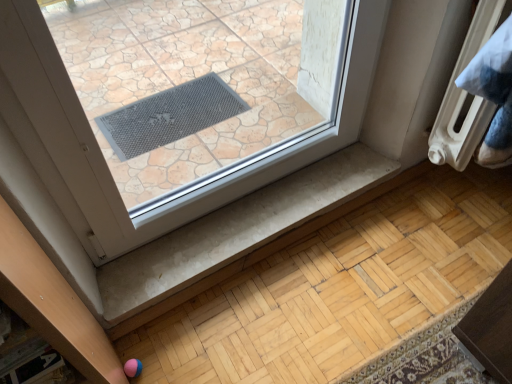
What is the approximate height of white matte stair at lower center?

white matte stair at lower center is 1.56 inches in height.

The width and height of the screenshot is (512, 384). What do you see at coordinates (236, 231) in the screenshot? I see `white matte stair at lower center` at bounding box center [236, 231].

Where is `white matte stair at lower center`? The height and width of the screenshot is (384, 512). white matte stair at lower center is located at coordinates (236, 231).

In order to face white matte stair at lower center, should I rotate leftwards or rightwards?

Turn right by 0.579 degrees to look at white matte stair at lower center.

Where is `white plastic radiator at upper right`? white plastic radiator at upper right is located at coordinates (465, 96).

This screenshot has height=384, width=512. What do you see at coordinates (465, 96) in the screenshot?
I see `white plastic radiator at upper right` at bounding box center [465, 96].

The height and width of the screenshot is (384, 512). In order to click on white matte stair at lower center in this screenshot , I will do `click(236, 231)`.

Would you say white plastic radiator at upper right is to the left or to the right of white matte stair at lower center in the picture?

white plastic radiator at upper right is to the right of white matte stair at lower center.

Considering the positions of objects white plastic radiator at upper right and white matte stair at lower center in the image provided, who is behind, white plastic radiator at upper right or white matte stair at lower center?

white matte stair at lower center is further away from the camera.

Does point (477, 129) lie behind point (121, 305)?

Yes, it is.

From the picture: From the image's perspective, is white plastic radiator at upper right on top of white matte stair at lower center?

Yes, from the image's perspective, white plastic radiator at upper right is above white matte stair at lower center.

From a real-world perspective, is white plastic radiator at upper right physically above white matte stair at lower center?

Yes, from a real-world perspective, white plastic radiator at upper right is on top of white matte stair at lower center.

Is white plastic radiator at upper right wider or thinner than white matte stair at lower center?

Clearly, white plastic radiator at upper right has less width compared to white matte stair at lower center.

Who is taller, white plastic radiator at upper right or white matte stair at lower center?

white plastic radiator at upper right.

Can you confirm if white plastic radiator at upper right is bigger than white matte stair at lower center?

Correct, white plastic radiator at upper right is larger in size than white matte stair at lower center.

Would you say white plastic radiator at upper right is outside white matte stair at lower center?

That's correct, white plastic radiator at upper right is outside of white matte stair at lower center.

Is white plastic radiator at upper right far away from white matte stair at lower center?

No.

Is white plastic radiator at upper right turned away from white matte stair at lower center?

No, white matte stair at lower center is not at the back of white plastic radiator at upper right.

The width and height of the screenshot is (512, 384). I want to click on stair below the white plastic radiator at upper right (from the image's perspective), so click(236, 231).

Is white matte stair at lower center to the right of white plastic radiator at upper right from the viewer's perspective?

Incorrect, white matte stair at lower center is not on the right side of white plastic radiator at upper right.

Does white matte stair at lower center lie behind white plastic radiator at upper right?

Yes, white matte stair at lower center is further from the camera.

Which is less distant, (131, 284) or (488, 112)?

Point (131, 284) appears to be farther away from the viewer than point (488, 112).

Consider the image. From the image's perspective, is white matte stair at lower center positioned above or below white plastic radiator at upper right?

white matte stair at lower center is below white plastic radiator at upper right.

From a real-world perspective, is white matte stair at lower center physically above white plastic radiator at upper right?

Incorrect, from a real-world perspective, white matte stair at lower center is lower than white plastic radiator at upper right.

Considering the sizes of objects white matte stair at lower center and white plastic radiator at upper right in the image provided, who is wider, white matte stair at lower center or white plastic radiator at upper right?

white matte stair at lower center is wider.

Consider the image. Is white matte stair at lower center taller than white plastic radiator at upper right?

Incorrect, the height of white matte stair at lower center is not larger of that of white plastic radiator at upper right.

Is white matte stair at lower center smaller than white plastic radiator at upper right?

Yes, white matte stair at lower center is smaller than white plastic radiator at upper right.

Does white matte stair at lower center contain white plastic radiator at upper right?

No.

Is white matte stair at lower center positioned far away from white plastic radiator at upper right?

No, white matte stair at lower center is in close proximity to white plastic radiator at upper right.

Is white plastic radiator at upper right at the back of white matte stair at lower center?

No.

How many degrees apart are the facing directions of white matte stair at lower center and white plastic radiator at upper right?

The angular difference between white matte stair at lower center and white plastic radiator at upper right is 0.443 degrees.

I want to click on radiator on the right of the white matte stair at lower center, so click(465, 96).

Where is `radiator lying on the right of white matte stair at lower center`? The width and height of the screenshot is (512, 384). radiator lying on the right of white matte stair at lower center is located at coordinates (465, 96).

Find the location of a particular element. The height and width of the screenshot is (384, 512). radiator above the white matte stair at lower center (from a real-world perspective) is located at coordinates (465, 96).